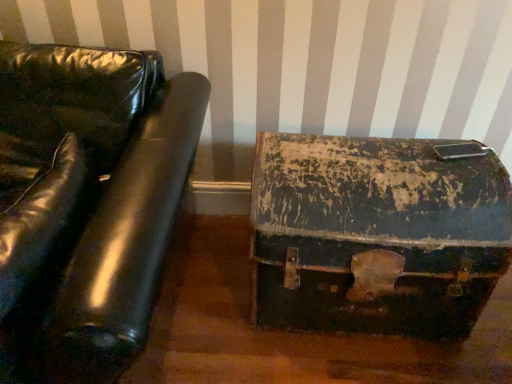
Question: Is rusty leather suitcase at lower right in front of or behind black leather couch at left in the image?

Choices:
 (A) front
 (B) behind

Answer: (B)

Question: Looking at the image, does rusty leather suitcase at lower right seem bigger or smaller compared to black leather couch at left?

Choices:
 (A) small
 (B) big

Answer: (A)

Question: Considering the positions of rusty leather suitcase at lower right and black leather couch at left in the image, is rusty leather suitcase at lower right wider or thinner than black leather couch at left?

Choices:
 (A) wide
 (B) thin

Answer: (B)

Question: From the image's perspective, is black leather couch at left positioned above or below rusty leather suitcase at lower right?

Choices:
 (A) below
 (B) above

Answer: (B)

Question: From their relative heights in the image, would you say black leather couch at left is taller or shorter than rusty leather suitcase at lower right?

Choices:
 (A) tall
 (B) short

Answer: (A)

Question: Relative to rusty leather suitcase at lower right, is black leather couch at left in front or behind?

Choices:
 (A) behind
 (B) front

Answer: (B)

Question: Based on their positions, is black leather couch at left located to the left or right of rusty leather suitcase at lower right?

Choices:
 (A) left
 (B) right

Answer: (A)